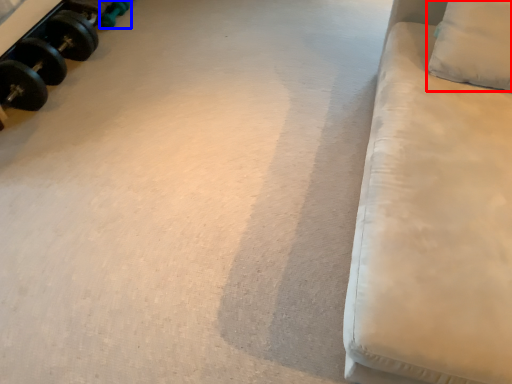
Question: Which object appears closest to the camera in this image, pillow (highlighted by a red box) or dumbbell (highlighted by a blue box)?

Choices:
 (A) pillow
 (B) dumbbell

Answer: (A)